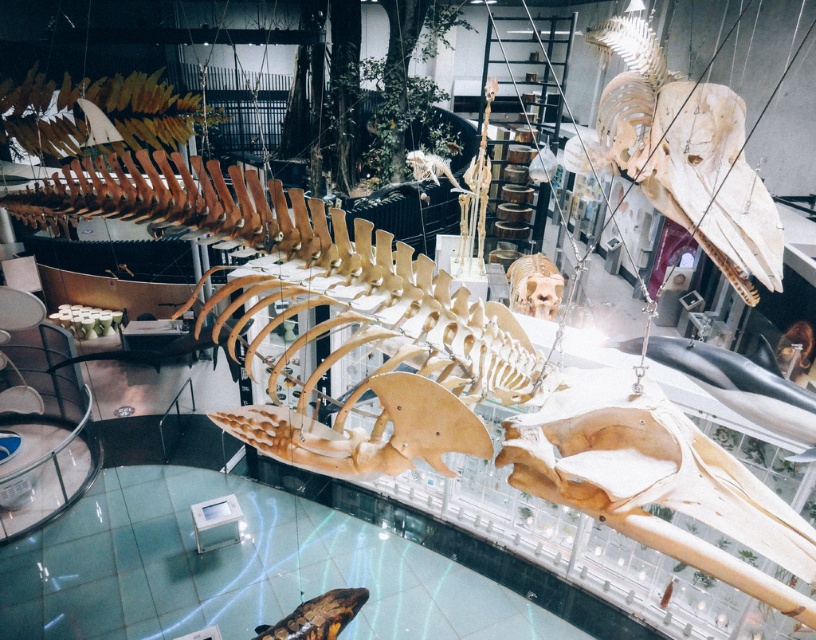
Does point (11, 579) lie in front of point (342, 602)?

No.

Is transparent glass table at lower center below brown matte skull at lower center?

Yes, transparent glass table at lower center is below brown matte skull at lower center.

Between point (642, 632) and point (344, 609), which one is positioned behind?

The point (642, 632) is behind.

Image resolution: width=816 pixels, height=640 pixels. In order to click on transparent glass table at lower center in this screenshot , I will do (x=255, y=570).

Looking at this image, is smooth gray dolphin at center bigger than brown matte skull at lower center?

Correct, smooth gray dolphin at center is larger in size than brown matte skull at lower center.

Is point (761, 396) closer to viewer compared to point (313, 618)?

Yes.

Describe the element at coordinates (744, 385) in the screenshot. I see `smooth gray dolphin at center` at that location.

This screenshot has width=816, height=640. I want to click on smooth gray dolphin at center, so click(744, 385).

Between transparent glass table at lower center and smooth gray dolphin at center, which one is positioned lower?

Positioned lower is transparent glass table at lower center.

Which of these two, transparent glass table at lower center or smooth gray dolphin at center, stands taller?

transparent glass table at lower center is taller.

Is point (300, 563) closer to viewer compared to point (645, 349)?

No.

This screenshot has width=816, height=640. In order to click on transparent glass table at lower center in this screenshot , I will do `click(255, 570)`.